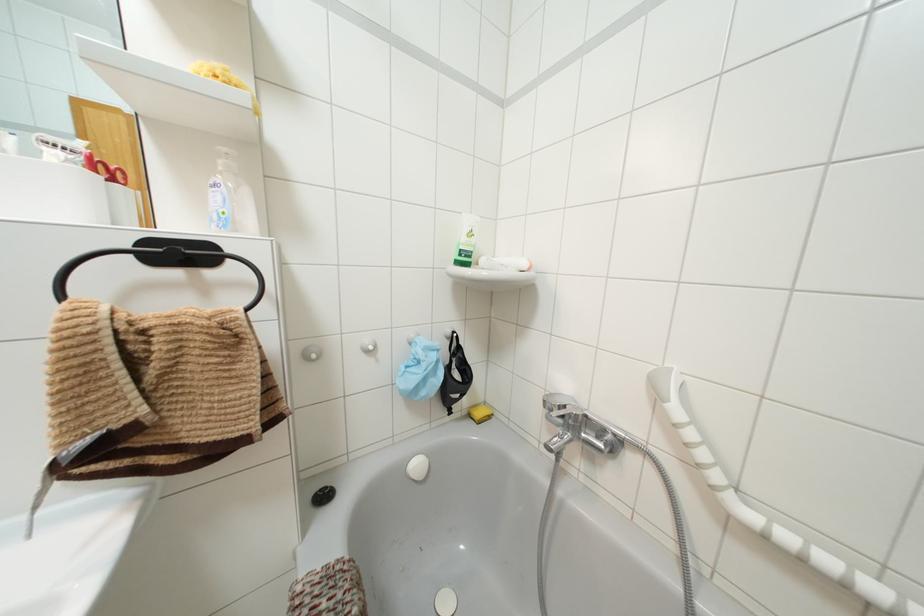
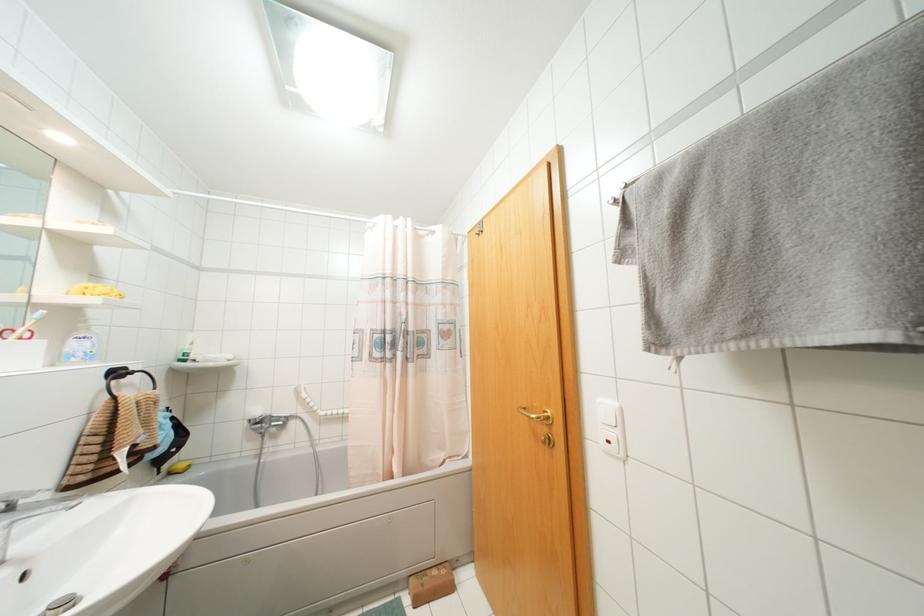
Find the pixel in the second image that matches (469,233) in the first image.

(190, 342)